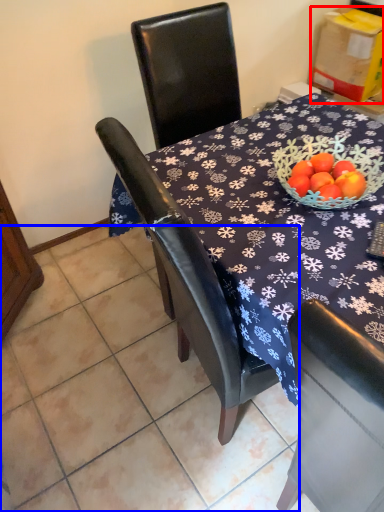
Question: Which object appears closest to the camera in this image, cardboard box (highlighted by a red box) or tile (highlighted by a blue box)?

Choices:
 (A) cardboard box
 (B) tile

Answer: (B)